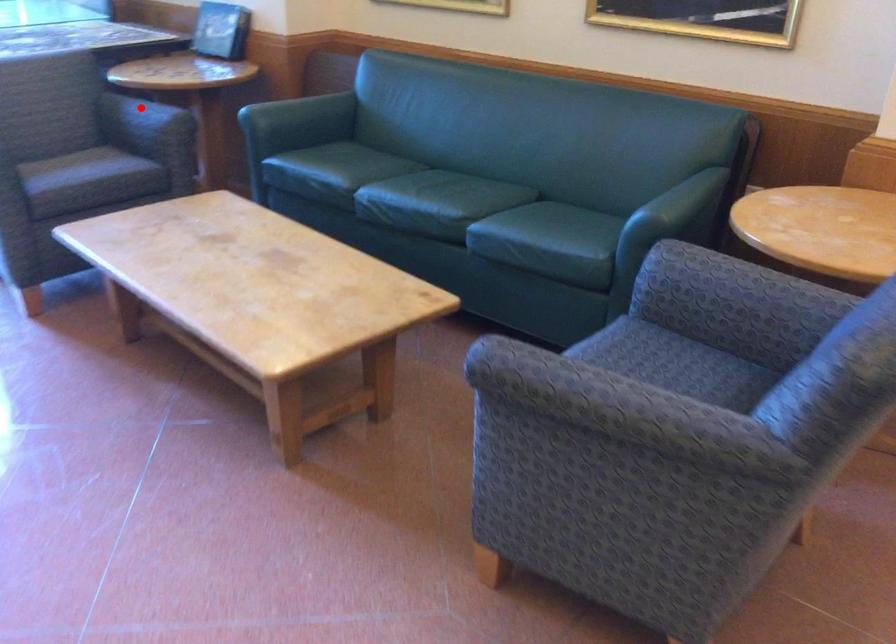
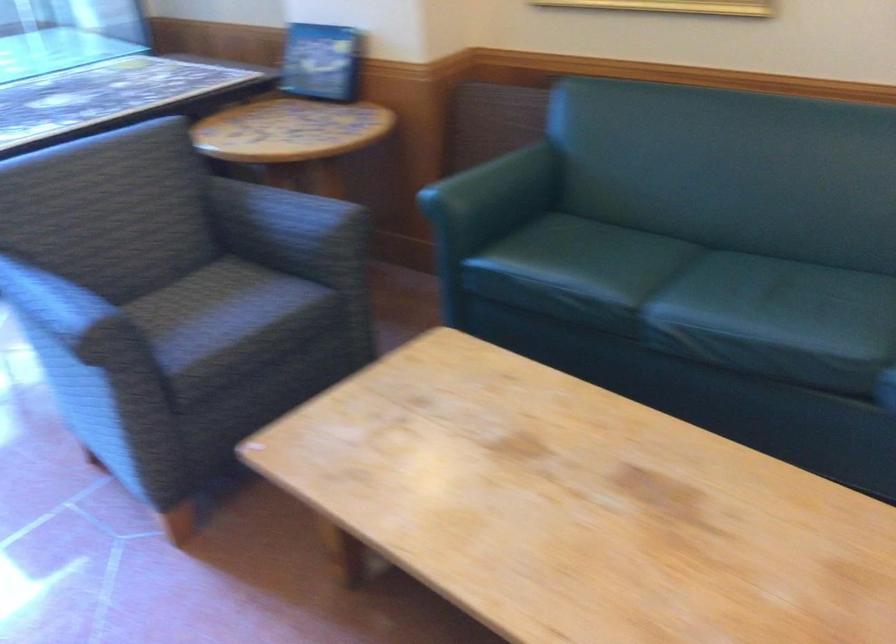
Question: I am providing you with two images of the same scene from different viewpoints. A red point is marked on the first image. Can you still see the location of the red point in image 2?

Choices:
 (A) Yes
 (B) No

Answer: (A)